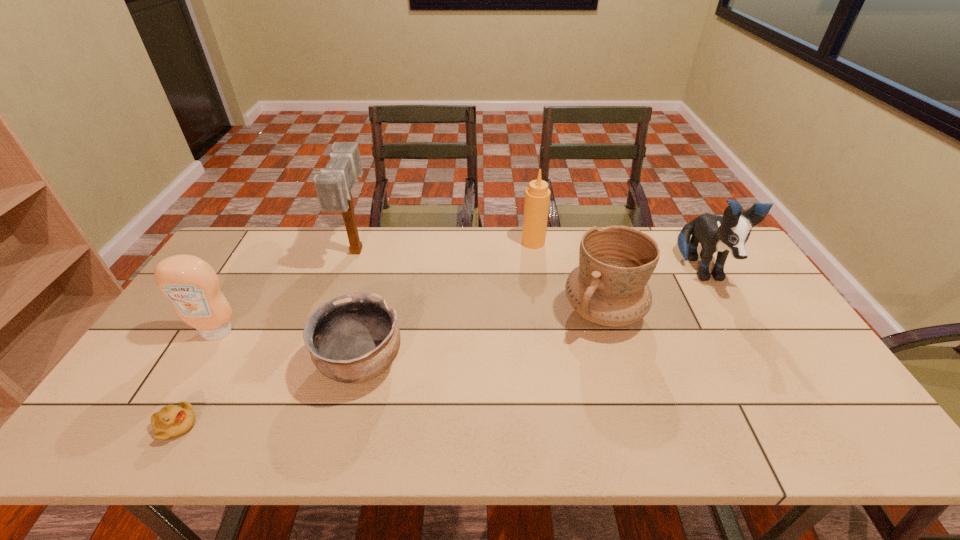
Identify the location of vacant space that satisfies the following two spatial constraints: 1. on the front side of the mallet; 2. on the front-facing side of the shortest object. (297, 426).